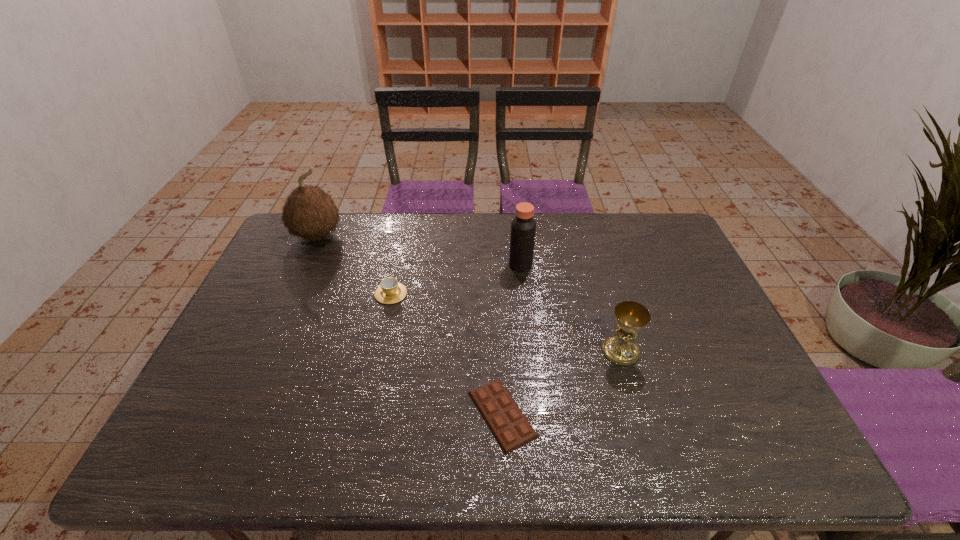
The image size is (960, 540). I want to click on vacant space located on the surface of the tallest object, so click(x=293, y=289).

At what (x,y) coordinates should I click in order to perform the action: click on free space located 0.230m on the back of the second tallest object. Please return your answer as a coordinate pair (x, y). This screenshot has height=540, width=960. Looking at the image, I should click on (516, 218).

Locate an element on the screen. vacant region located on the back of the rightmost object is located at coordinates (604, 296).

Where is `free space located 0.290m with the handle on the side of the cup`? This screenshot has height=540, width=960. free space located 0.290m with the handle on the side of the cup is located at coordinates (405, 228).

Identify the location of vacant area situated 0.120m with the handle on the side of the cup. Image resolution: width=960 pixels, height=540 pixels. (398, 258).

Identify the location of vacant space positioned with the handle on the side of the cup. The image size is (960, 540). pos(406,223).

What are the coordinates of `vacant area situated on the back of the shortest object` in the screenshot? It's located at (500, 362).

Where is `object located at the far edge`? This screenshot has width=960, height=540. object located at the far edge is located at coordinates (309, 212).

Where is `object that is at the near edge`? This screenshot has height=540, width=960. object that is at the near edge is located at coordinates (511, 429).

The height and width of the screenshot is (540, 960). Identify the location of object present at the left edge. (309, 212).